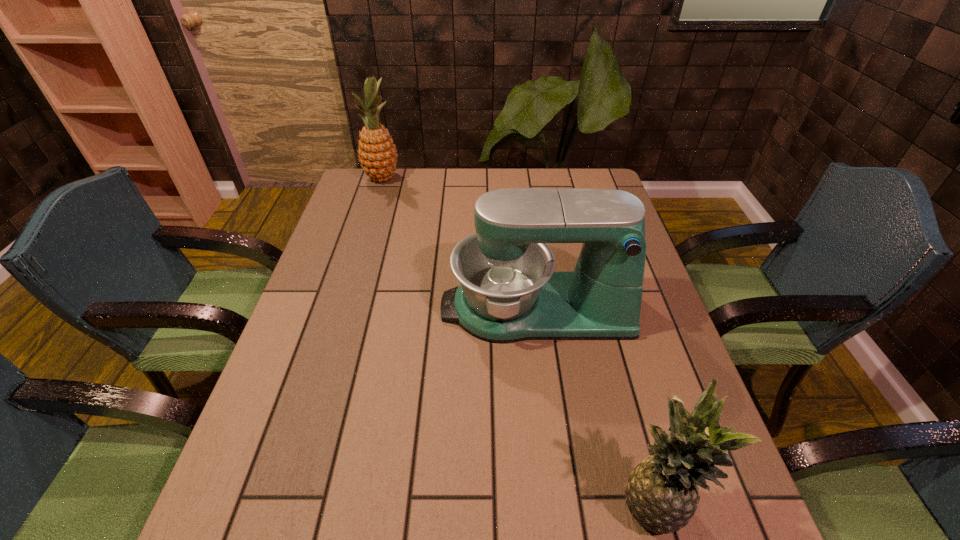
The image size is (960, 540). Find the location of `the leftmost object`. the leftmost object is located at coordinates 377,154.

Identify the location of the farther pineapple. (377, 154).

Locate an element on the screen. This screenshot has height=540, width=960. mixer is located at coordinates (509, 292).

Find the location of a particular element. This screenshot has width=960, height=540. vacant space located 0.050m on the front of the farthest object is located at coordinates (376, 197).

Identify the location of blank area located on the front-facing side of the second farthest object. The height and width of the screenshot is (540, 960). (343, 308).

Locate an element on the screen. The height and width of the screenshot is (540, 960). vacant point located 0.330m on the front-facing side of the second farthest object is located at coordinates (312, 308).

Find the location of a particular element. The image size is (960, 540). vacant space located 0.350m on the front-facing side of the second farthest object is located at coordinates (303, 308).

You are a GUI agent. You are given a task and a screenshot of the screen. Output one action in this format:
    pyautogui.click(x=<x>, y=<y>)
    Task: Click on the object situated at the far edge
    
    Given the screenshot: What is the action you would take?
    pyautogui.click(x=377, y=154)

In order to click on object at the left edge in this screenshot , I will do `click(377, 154)`.

You are a GUI agent. You are given a task and a screenshot of the screen. Output one action in this format:
    pyautogui.click(x=<x>, y=<y>)
    Task: Click on the object present at the right edge
    Image resolution: width=960 pixels, height=540 pixels.
    Given the screenshot: What is the action you would take?
    pyautogui.click(x=509, y=292)